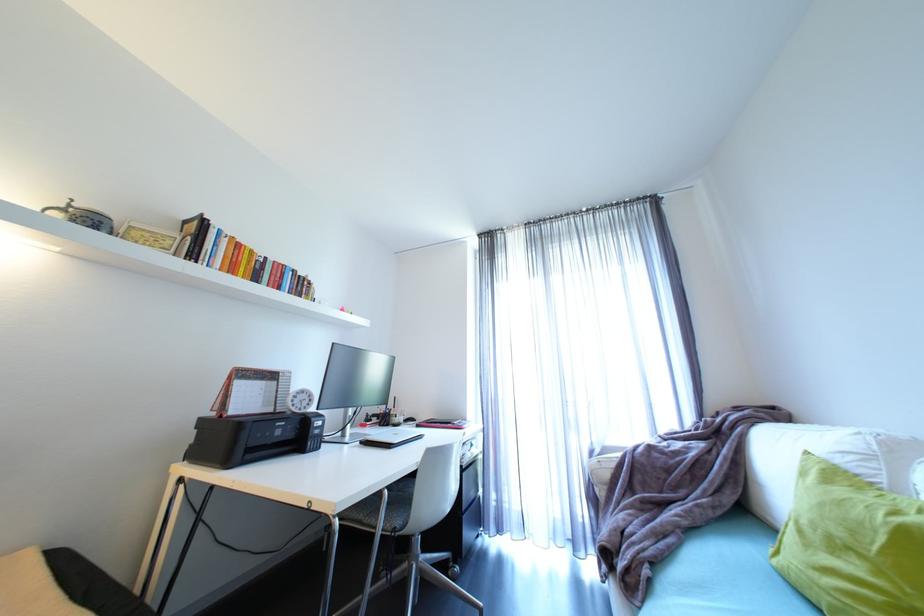
At what (x,y) coordinates should I click in order to perform the action: click on colorful book. Please return your answer as a coordinate pair (x, y). Looking at the image, I should click on (x=238, y=259).